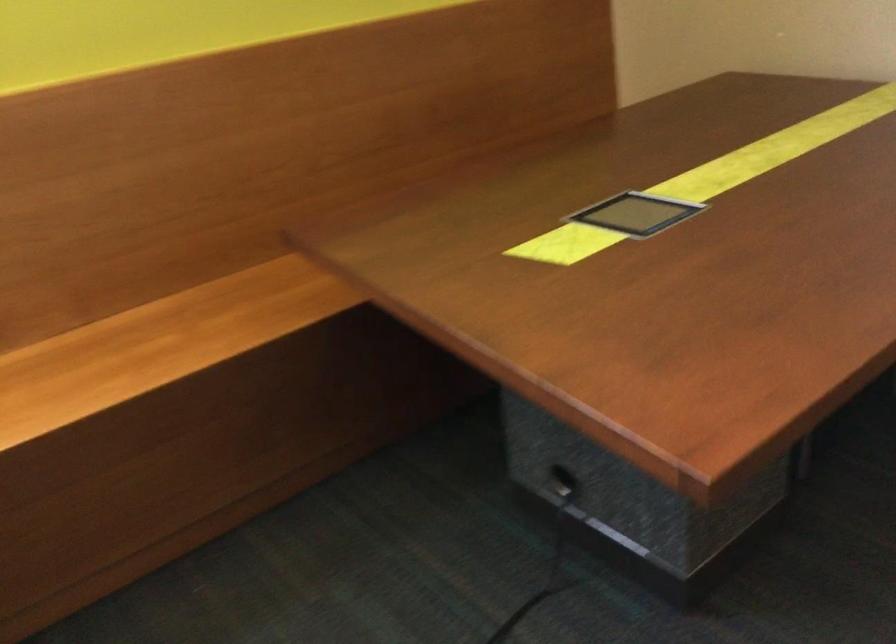
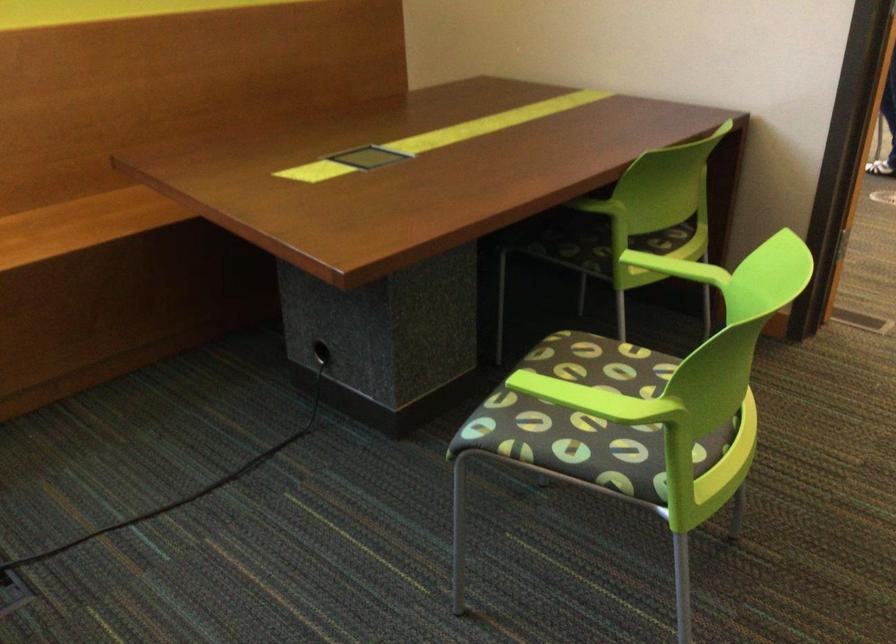
Find the pixel in the second image that matches [240,313] in the first image.

(80, 223)